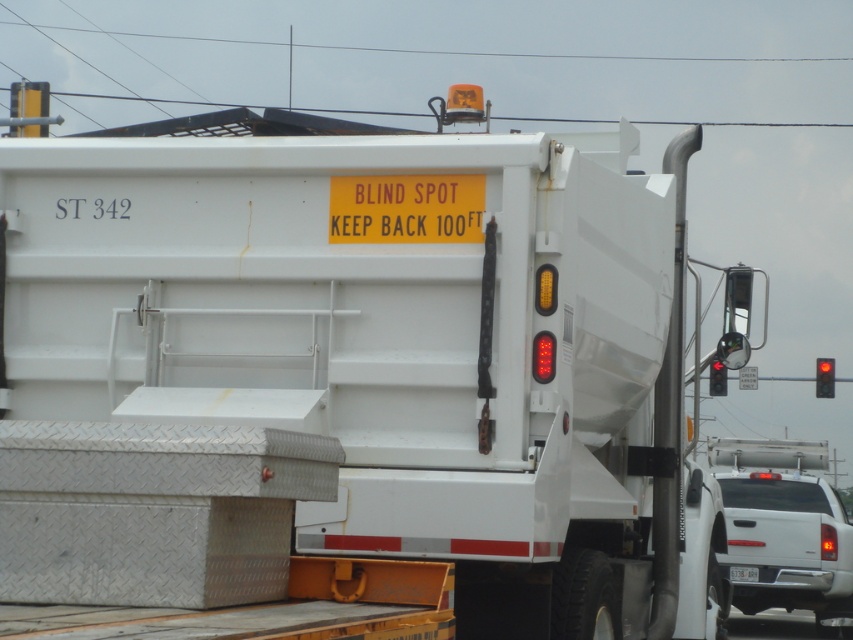
Does red glass traffic light at upper right appear on the right side of white plastic license plate at center?

Yes, red glass traffic light at upper right is to the right of white plastic license plate at center.

From the picture: Does red glass traffic light at upper right have a lesser height compared to white plastic license plate at center?

No.

Is point (717, 394) behind point (743, 564)?

Yes.

The width and height of the screenshot is (853, 640). Find the location of `red glass traffic light at upper right`. red glass traffic light at upper right is located at coordinates (717, 378).

Is white glossy truck at lower right smaller than white plastic license plate at center?

Incorrect, white glossy truck at lower right is not smaller in size than white plastic license plate at center.

Is point (772, 492) positioned in front of point (741, 568)?

No, (772, 492) is behind (741, 568).

Between point (740, 490) and point (743, 577), which one is positioned in front?

Positioned in front is point (743, 577).

The height and width of the screenshot is (640, 853). Find the location of `white glossy truck at lower right`. white glossy truck at lower right is located at coordinates (785, 529).

Locate an element on the screen. black wire at upper center is located at coordinates (460, 65).

Does black wire at upper center have a smaller size compared to red glass traffic light at upper right?

Actually, black wire at upper center might be larger than red glass traffic light at upper right.

Does point (329, 19) come farther from viewer compared to point (724, 372)?

Yes, point (329, 19) is farther from viewer.

Image resolution: width=853 pixels, height=640 pixels. I want to click on black wire at upper center, so click(x=460, y=65).